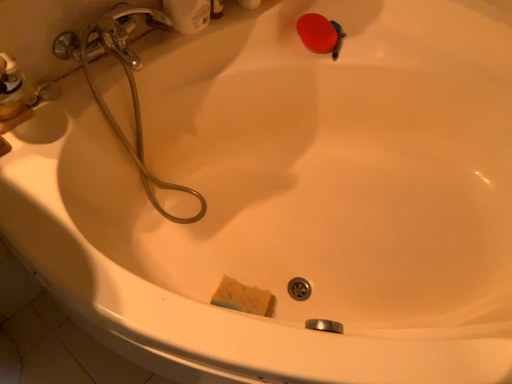
What do you see at coordinates (122, 32) in the screenshot?
I see `brushed metal faucet at upper left` at bounding box center [122, 32].

At what (x,y) coordinates should I click in order to perform the action: click on brushed metal faucet at upper left. Please return your answer as a coordinate pair (x, y). Looking at the image, I should click on (122, 32).

You are a GUI agent. You are given a task and a screenshot of the screen. Output one action in this format:
    pyautogui.click(x=<x>, y=<y>)
    Task: Click on the brushed metal faucet at upper left
    The height and width of the screenshot is (384, 512).
    Given the screenshot: What is the action you would take?
    pyautogui.click(x=122, y=32)